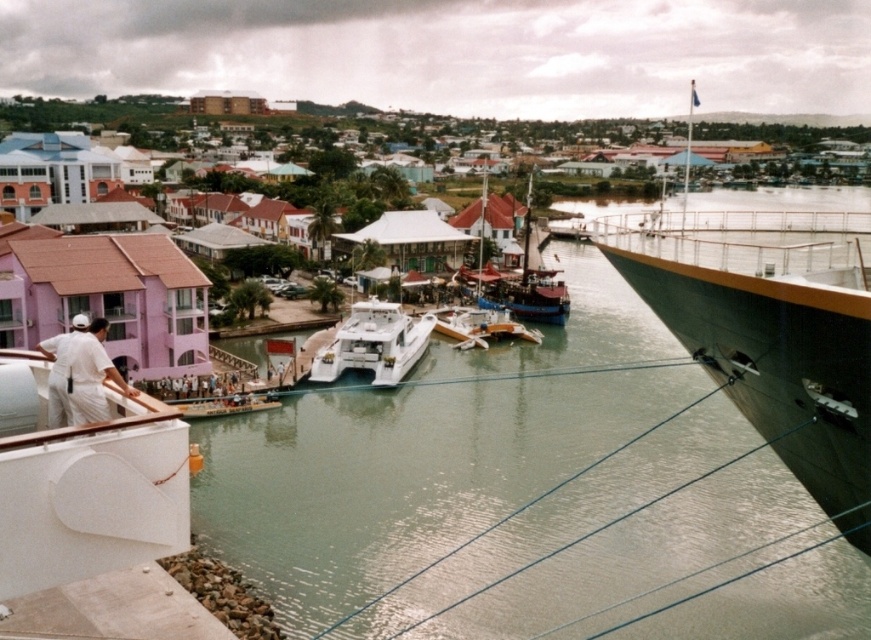
Between dark gray metallic cruise ship at right and white glossy catamaran at center, which one appears on the left side from the viewer's perspective?

Positioned to the left is white glossy catamaran at center.

Is dark gray metallic cruise ship at right taller than white glossy catamaran at center?

Yes, dark gray metallic cruise ship at right is taller than white glossy catamaran at center.

Who is more forward, (828,353) or (416,352)?

Point (828,353) is more forward.

I want to click on dark gray metallic cruise ship at right, so pyautogui.click(x=771, y=330).

Between white uniform at left and white matte uniform at lower left, which one is positioned higher?

white uniform at left is above.

Who is more distant from viewer, [91,416] or [59,387]?

Positioned behind is point [59,387].

Does point (95, 403) come closer to viewer compared to point (55, 336)?

Yes, it is.

Image resolution: width=871 pixels, height=640 pixels. Identify the location of white uniform at left. [x=91, y=376].

Between point (402, 376) and point (510, 308), which one is positioned behind?

The point (510, 308) is more distant.

The image size is (871, 640). Find the location of `white glossy catamaran at center`. white glossy catamaran at center is located at coordinates (373, 342).